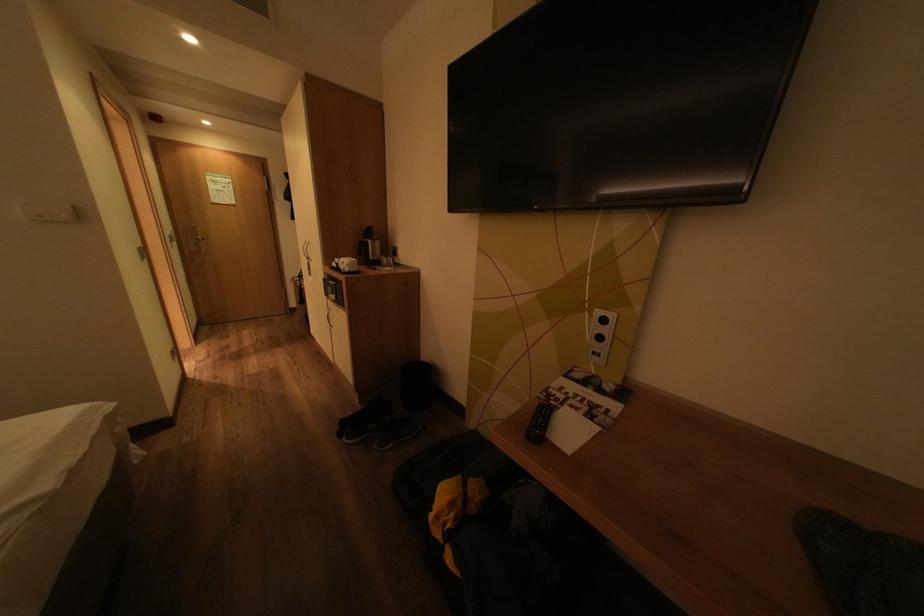
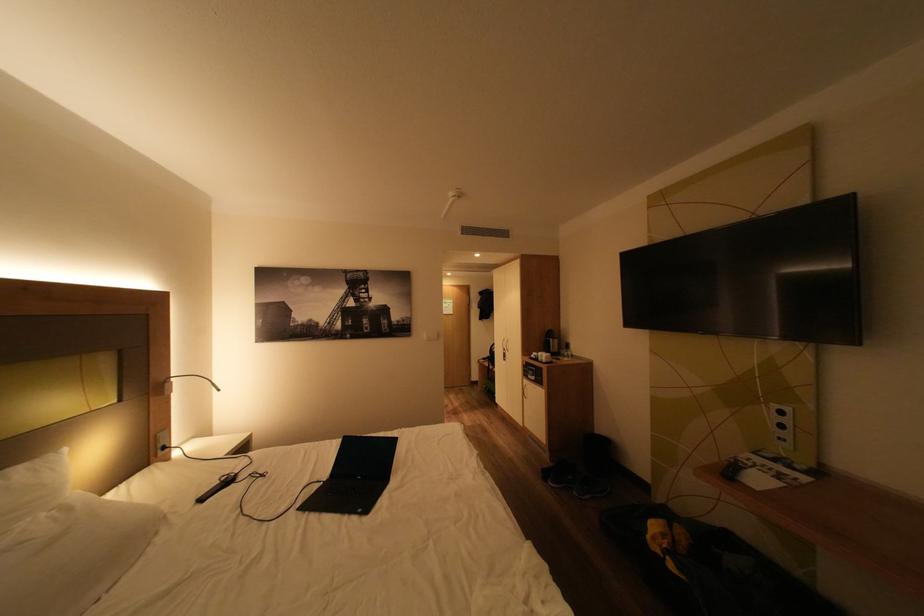
Where in the second image is the point corresponding to (x=611, y=339) from the first image?

(793, 427)